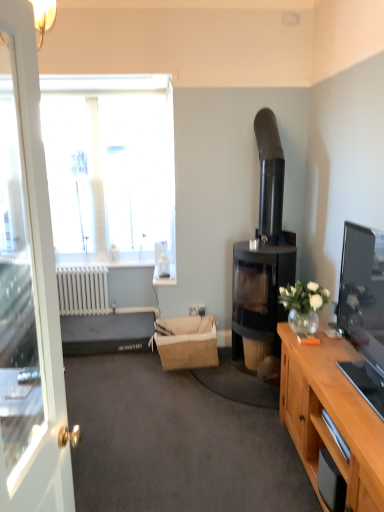
The width and height of the screenshot is (384, 512). Describe the element at coordinates (263, 257) in the screenshot. I see `black glass fireplace at right` at that location.

Measure the distance between transparent glass window at upper left and camera.

The distance of transparent glass window at upper left from camera is 3.75 meters.

Locate an element on the screen. This screenshot has height=512, width=384. brown woven picnic basket at center is located at coordinates (187, 342).

What do you see at coordinates (187, 342) in the screenshot? The width and height of the screenshot is (384, 512). I see `brown woven picnic basket at center` at bounding box center [187, 342].

Locate an element on the screen. white plastic power outlet at center is located at coordinates click(197, 310).

In order to face white glossy door at left, should I rotate leftwards or rightwards?

Turn left approximately 22.987 degrees to face it.

Measure the distance between point (x=71, y=304) and camera.

They are 14.38 feet apart.

Locate an element on the screen. dark gray fabric bed at lower left is located at coordinates (107, 333).

Is white painted metal radiator at lower left placed right next to dark gray fabric bed at lower left?

No, white painted metal radiator at lower left is not in contact with dark gray fabric bed at lower left.

Which point is more distant from viewer, (109, 310) or (106, 352)?

Point (109, 310)

Can we say white painted metal radiator at lower left lies outside dark gray fabric bed at lower left?

Yes, white painted metal radiator at lower left is outside of dark gray fabric bed at lower left.

Can you confirm if white painted metal radiator at lower left is smaller than dark gray fabric bed at lower left?

Correct, white painted metal radiator at lower left occupies less space than dark gray fabric bed at lower left.

Consider the image. Between white glossy door at left and brown woven picnic basket at center, which one has larger size?

white glossy door at left.

From the image's perspective, is white glossy door at left above or below brown woven picnic basket at center?

white glossy door at left is situated higher than brown woven picnic basket at center in the image.

From the picture: How much distance is there between white glossy door at left and brown woven picnic basket at center?

A distance of 1.25 meters exists between white glossy door at left and brown woven picnic basket at center.

Does white glossy door at left have a lesser height compared to brown woven picnic basket at center?

In fact, white glossy door at left may be taller than brown woven picnic basket at center.

Which of these two, brown woven picnic basket at center or white glossy door at left, is thinner?

With smaller width is brown woven picnic basket at center.

Does point (165, 354) come closer to viewer compared to point (7, 300)?

Yes, point (165, 354) is closer to viewer.

From the image's perspective, is brown woven picnic basket at center positioned above or below white glossy door at left?

Clearly, from the image's perspective, brown woven picnic basket at center is below white glossy door at left.

Considering the sizes of objects brown woven picnic basket at center and white glossy door at left in the image provided, who is taller, brown woven picnic basket at center or white glossy door at left?

With more height is white glossy door at left.

From a real-world perspective, is black glass fireplace at right below dark gray fabric bed at lower left?

No, from a real-world perspective, black glass fireplace at right is not beneath dark gray fabric bed at lower left.

Between black glass fireplace at right and dark gray fabric bed at lower left, which one appears on the right side from the viewer's perspective?

From the viewer's perspective, black glass fireplace at right appears more on the right side.

In terms of size, does black glass fireplace at right appear bigger or smaller than dark gray fabric bed at lower left?

In the image, black glass fireplace at right appears to be larger than dark gray fabric bed at lower left.

Are black glass fireplace at right and dark gray fabric bed at lower left far apart?

Yes, black glass fireplace at right and dark gray fabric bed at lower left are quite far apart.

Is black glass fireplace at right not close to brown woven picnic basket at center?

No, black glass fireplace at right is in close proximity to brown woven picnic basket at center.

Is black glass fireplace at right to the right of brown woven picnic basket at center from the viewer's perspective?

Yes, black glass fireplace at right is to the right of brown woven picnic basket at center.

Is black glass fireplace at right situated inside brown woven picnic basket at center or outside?

black glass fireplace at right exists outside the volume of brown woven picnic basket at center.

From a real-world perspective, is white painted metal radiator at lower left below black glass fireplace at right?

Yes, from a real-world perspective, white painted metal radiator at lower left is beneath black glass fireplace at right.

Is white painted metal radiator at lower left facing towards black glass fireplace at right?

No.

What's the angular difference between white painted metal radiator at lower left and black glass fireplace at right's facing directions?

They differ by 89.3 degrees in their facing directions.

Could white plastic power outlet at center be considered to be inside brown woven picnic basket at center?

Yes, white plastic power outlet at center is inside brown woven picnic basket at center.

Which object is more forward, brown woven picnic basket at center or white plastic power outlet at center?

brown woven picnic basket at center is more forward.

How much distance is there between brown woven picnic basket at center and white plastic power outlet at center?

brown woven picnic basket at center is 12.88 inches away from white plastic power outlet at center.

From a real-world perspective, is brown woven picnic basket at center physically located above or below white plastic power outlet at center?

brown woven picnic basket at center is situated lower than white plastic power outlet at center in the real world.

Locate an element on the screen. flat lying on the right of white painted metal radiator at lower left is located at coordinates (107, 333).

You are a GUI agent. You are given a task and a screenshot of the screen. Output one action in this format:
    pyautogui.click(x=<x>, y=<y>)
    Task: Click on the door above the brown woven picnic basket at center (from the image's perspective)
    Image resolution: width=384 pixels, height=512 pixels.
    Given the screenshot: What is the action you would take?
    pyautogui.click(x=28, y=294)

Looking at the image, which one is located further to black glass fireplace at right, dark gray fabric bed at lower left or brown woven picnic basket at center?

dark gray fabric bed at lower left is further to black glass fireplace at right.

When comparing their distances from white plastic power outlet at center, does white painted metal radiator at lower left or brown woven picnic basket at center seem further?

white painted metal radiator at lower left lies further to white plastic power outlet at center than the other object.

Based on their spatial positions, is brown woven picnic basket at center or dark gray fabric bed at lower left closer to white glossy door at left?

dark gray fabric bed at lower left.

From the image, which object appears to be nearer to brown woven picnic basket at center, white glossy door at left or white plastic power outlet at center?

The object closer to brown woven picnic basket at center is white plastic power outlet at center.

From the image, which object appears to be farther from transparent glass window at upper left, brown woven picnic basket at center or white plastic power outlet at center?

Based on the image, white plastic power outlet at center appears to be further to transparent glass window at upper left.

Which object lies nearer to the anchor point white plastic power outlet at center, transparent glass window at upper left or dark gray fabric bed at lower left?

Based on the image, dark gray fabric bed at lower left appears to be nearer to white plastic power outlet at center.

Which object lies nearer to the anchor point dark gray fabric bed at lower left, white plastic power outlet at center or white glossy door at left?

The object closer to dark gray fabric bed at lower left is white glossy door at left.

Consider the image. From the image, which object appears to be farther from brown woven picnic basket at center, white glossy door at left or transparent glass window at upper left?

Based on the image, transparent glass window at upper left appears to be further to brown woven picnic basket at center.

Locate an element on the screen. This screenshot has height=512, width=384. flat between white painted metal radiator at lower left and white plastic power outlet at center in the horizontal direction is located at coordinates (107, 333).

I want to click on window between white glossy door at left and white painted metal radiator at lower left from front to back, so click(x=109, y=165).

Locate an element on the screen. This screenshot has width=384, height=512. power outlet located between white painted metal radiator at lower left and black glass fireplace at right in the left-right direction is located at coordinates (197, 310).

Image resolution: width=384 pixels, height=512 pixels. I want to click on flat between white glossy door at left and white plastic power outlet at center from front to back, so tap(107, 333).